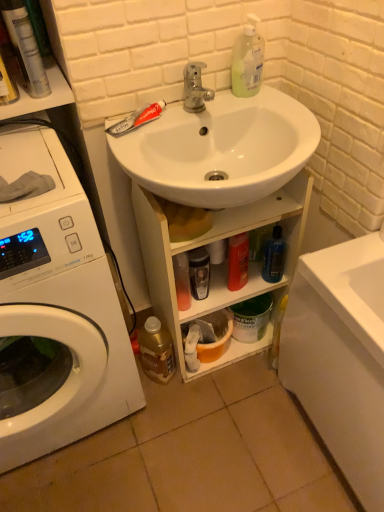
Find the location of a particular element. This screenshot has width=384, height=512. free location to the right of gold metallic bottle at lower left, the first bottle when ordered from bottom to top is located at coordinates (218, 389).